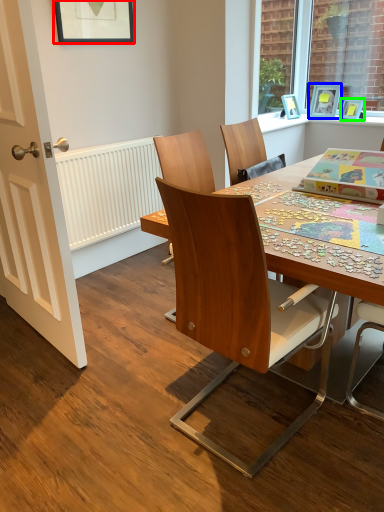
Question: Based on their relative distances, which object is nearer to picture frame (highlighted by a red box)? Choose from picture frame (highlighted by a blue box) and picture frame (highlighted by a green box).

Choices:
 (A) picture frame
 (B) picture frame

Answer: (A)